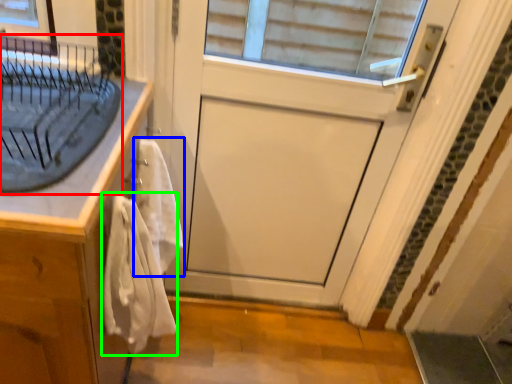
Question: Based on their relative distances, which object is nearer to sink (highlighted by a red box)? Choose from bath towel (highlighted by a blue box) and bath towel (highlighted by a green box).

Choices:
 (A) bath towel
 (B) bath towel

Answer: (A)